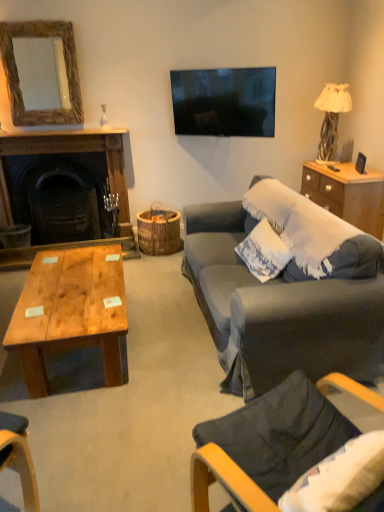
Locate an element on the screen. Image resolution: width=384 pixels, height=512 pixels. wooden frame mirror at upper left is located at coordinates (17, 71).

What do you see at coordinates (333, 168) in the screenshot? The image size is (384, 512). I see `black plastic remote control at right` at bounding box center [333, 168].

What is the approximate height of wooden cabinet at right?

wooden cabinet at right is 60.33 centimeters tall.

Locate an element on the screen. This screenshot has width=384, height=512. wooden cabinet at right is located at coordinates (347, 194).

The width and height of the screenshot is (384, 512). Find the location of `metallic silver picture frame at right`. metallic silver picture frame at right is located at coordinates (360, 163).

At what (x,y) coordinates should I click in order to perform the action: click on white textured pillow at right. Please return your answer as a coordinate pair (x, y). Looking at the image, I should click on (264, 252).

Describe the element at coordinates (70, 312) in the screenshot. The width and height of the screenshot is (384, 512). I see `wooden coffee table at center` at that location.

Measure the distance between dark gray fabric chair at lower right and camera.

They are 4.17 feet apart.

Locate an element on the screen. wooden frame mirror at upper left is located at coordinates (17, 71).

Based on the photo, which object is more forward, white textured pillow at right or black plastic remote control at right?

white textured pillow at right.

Based on the photo, can you confirm if white textured pillow at right is bigger than black plastic remote control at right?

Correct, white textured pillow at right is larger in size than black plastic remote control at right.

Can you confirm if white textured pillow at right is thinner than black plastic remote control at right?

Correct, the width of white textured pillow at right is less than that of black plastic remote control at right.

Can we say white textured pillow at right lies outside black plastic remote control at right?

white textured pillow at right lies outside black plastic remote control at right's area.

Is black plastic remote control at right a part of dark wood fireplace at left?

Definitely not — black plastic remote control at right is not inside dark wood fireplace at left.

Where is `fireplace below the black plastic remote control at right (from a real-world perspective)`? fireplace below the black plastic remote control at right (from a real-world perspective) is located at coordinates (70, 152).

Consider the image. Which of these two, dark wood fireplace at left or black plastic remote control at right, is wider?

dark wood fireplace at left.

From the image's perspective, is dark wood fireplace at left located beneath black plastic remote control at right?

Yes, from the image's perspective, dark wood fireplace at left is below black plastic remote control at right.

Could you tell me if wooden frame mirror at upper left is turned towards dark gray fabric chair at lower right?

Yes, wooden frame mirror at upper left is aimed at dark gray fabric chair at lower right.

From the image's perspective, between wooden frame mirror at upper left and dark gray fabric chair at lower right, which one is located above?

wooden frame mirror at upper left appears higher in the image.

From their relative heights in the image, would you say wooden frame mirror at upper left is taller or shorter than dark gray fabric chair at lower right?

wooden frame mirror at upper left is taller than dark gray fabric chair at lower right.

Consider the image. Visually, is wooden frame mirror at upper left positioned to the left or to the right of dark gray fabric chair at lower right?

From the image, it's evident that wooden frame mirror at upper left is to the left of dark gray fabric chair at lower right.

Does white textured pillow at right have a greater width compared to metallic silver picture frame at right?

Indeed, white textured pillow at right has a greater width compared to metallic silver picture frame at right.

From a real-world perspective, is white textured pillow at right physically located above or below metallic silver picture frame at right?

white textured pillow at right is below metallic silver picture frame at right.

Can you confirm if white textured pillow at right is bigger than metallic silver picture frame at right?

Yes.

Is white textured pillow at right directly adjacent to metallic silver picture frame at right?

No, white textured pillow at right is not with metallic silver picture frame at right.

Which is closer, (x=290, y=252) or (x=332, y=128)?

The point (x=290, y=252) is closer to the camera.

Which object is positioned more to the left, white textured pillow at right or white fabric lampshade at right?

From the viewer's perspective, white textured pillow at right appears more on the left side.

Is white textured pillow at right turned away from white fabric lampshade at right?

No, white textured pillow at right is not facing the opposite direction of white fabric lampshade at right.

Which object is thinner, white textured pillow at right or wooden coffee table at center?

Thinner between the two is white textured pillow at right.

Considering the positions of objects white textured pillow at right and wooden coffee table at center in the image provided, who is behind, white textured pillow at right or wooden coffee table at center?

white textured pillow at right.

Consider the image. Is white textured pillow at right aimed at wooden coffee table at center?

Yes, white textured pillow at right faces towards wooden coffee table at center.

Considering the sizes of white textured pillow at right and wooden coffee table at center in the image, is white textured pillow at right taller or shorter than wooden coffee table at center?

Clearly, white textured pillow at right is taller compared to wooden coffee table at center.

Is white textured pillow at right shorter than dark wood fireplace at left?

Indeed, white textured pillow at right has a lesser height compared to dark wood fireplace at left.

How much distance is there between white textured pillow at right and dark wood fireplace at left?

The distance of white textured pillow at right from dark wood fireplace at left is 6.24 feet.

Is white textured pillow at right facing towards dark wood fireplace at left?

No, white textured pillow at right is not turned towards dark wood fireplace at left.

Does white textured pillow at right have a greater width compared to dark wood fireplace at left?

No.

At what (x,y) coordinates should I click in order to perform the action: click on remote control above the white textured pillow at right (from a real-world perspective). Please return your answer as a coordinate pair (x, y). The height and width of the screenshot is (512, 384). Looking at the image, I should click on (333, 168).

Where is `fireplace below the black plastic remote control at right (from a real-world perspective)`? Image resolution: width=384 pixels, height=512 pixels. fireplace below the black plastic remote control at right (from a real-world perspective) is located at coordinates (70, 152).

Considering their positions, is wooden cabinet at right positioned closer to wooden coffee table at center than dark wood fireplace at left?

dark wood fireplace at left lies closer to wooden coffee table at center than the other object.

When comparing their distances from wooden coffee table at center, does wooden cabinet at right or white fabric lampshade at right seem further?

white fabric lampshade at right is further to wooden coffee table at center.

From the image, which object appears to be farther from white fabric lampshade at right, wooden cabinet at right or metallic silver picture frame at right?

wooden cabinet at right is further to white fabric lampshade at right.

Based on their spatial positions, is dark wood fireplace at left or black plastic remote control at right further from wooden coffee table at center?

black plastic remote control at right lies further to wooden coffee table at center than the other object.

When comparing their distances from metallic silver picture frame at right, does wooden cabinet at right or white fabric lampshade at right seem further?

The object further to metallic silver picture frame at right is white fabric lampshade at right.

Considering their positions, is wooden coffee table at center positioned further to black plastic remote control at right than wooden frame mirror at upper left?

wooden frame mirror at upper left lies further to black plastic remote control at right than the other object.

Based on their spatial positions, is white textured pillow at right or wooden frame mirror at upper left further from metallic silver picture frame at right?

wooden frame mirror at upper left lies further to metallic silver picture frame at right than the other object.

Based on their spatial positions, is wooden cabinet at right or black plastic remote control at right closer to white fabric lampshade at right?

The object closer to white fabric lampshade at right is black plastic remote control at right.

Locate an element on the screen. pillow between wooden frame mirror at upper left and metallic silver picture frame at right from left to right is located at coordinates (264, 252).

You are a GUI agent. You are given a task and a screenshot of the screen. Output one action in this format:
    pyautogui.click(x=<x>, y=<y>)
    Task: Click on the cabinetry between dark gray fabric chair at lower right and metallic silver picture frame at right from front to back
    The width and height of the screenshot is (384, 512).
    Given the screenshot: What is the action you would take?
    pyautogui.click(x=347, y=194)

Locate an element on the screen. cabinetry between dark gray fabric chair at lower right and dark wood fireplace at left along the z-axis is located at coordinates (347, 194).

You are a GUI agent. You are given a task and a screenshot of the screen. Output one action in this format:
    pyautogui.click(x=<x>, y=<y>)
    Task: Click on the coffee table between dark gray fabric chair at lower right and white fabric lampshade at right from front to back
    This screenshot has width=384, height=512.
    Given the screenshot: What is the action you would take?
    pyautogui.click(x=70, y=312)